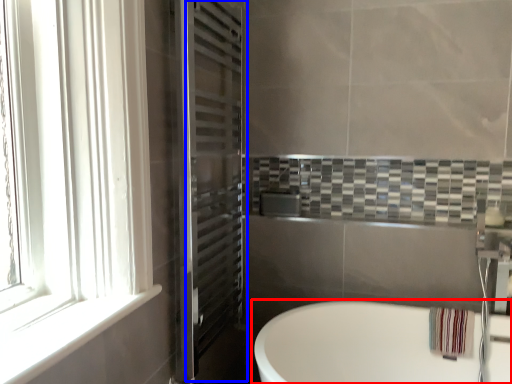
Question: Which object appears farthest to the camera in this image, bathtub (highlighted by a red box) or screen door (highlighted by a blue box)?

Choices:
 (A) bathtub
 (B) screen door

Answer: (B)